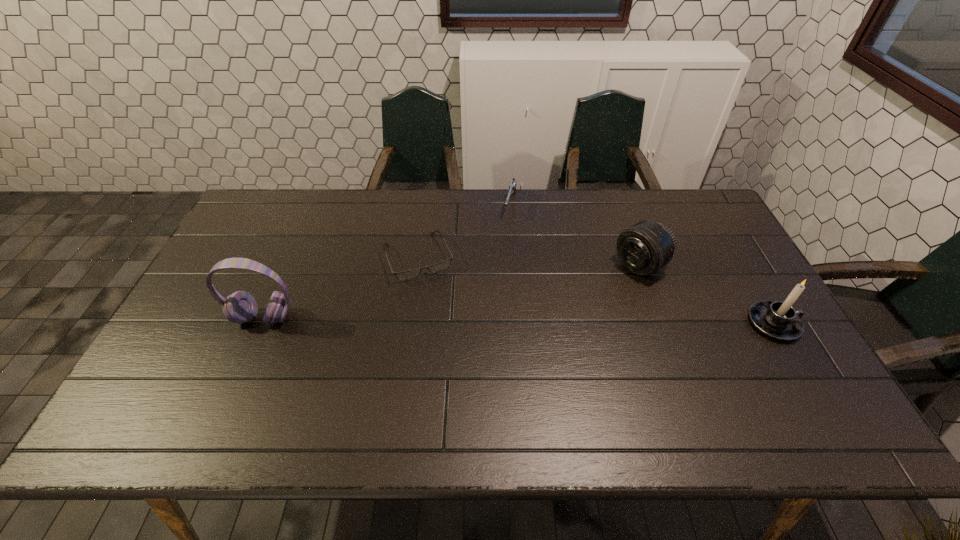
Image resolution: width=960 pixels, height=540 pixels. In order to click on vacant space situated 0.120m on the front-facing side of the fourth object from right to left in this screenshot , I will do `click(442, 312)`.

The height and width of the screenshot is (540, 960). I want to click on free space located on the front-facing side of the fourth object from right to left, so click(453, 340).

Locate an element on the screen. Image resolution: width=960 pixels, height=540 pixels. free region located 0.140m on the front-facing side of the fourth object from right to left is located at coordinates (444, 317).

Find the location of a particular element. The image size is (960, 540). vacant region located 0.280m on the front-facing side of the telephoto lens is located at coordinates (552, 321).

The height and width of the screenshot is (540, 960). In order to click on vacant space located 0.070m on the front-facing side of the telephoto lens in this screenshot , I will do `click(606, 287)`.

I want to click on blank space located on the front-facing side of the telephoto lens, so click(591, 296).

Where is `free location located on the front-facing side of the pistol`? free location located on the front-facing side of the pistol is located at coordinates (506, 232).

What are the coordinates of `free space located on the front-facing side of the pistol` in the screenshot? It's located at (492, 279).

Image resolution: width=960 pixels, height=540 pixels. What are the coordinates of `vacant area situated 0.360m on the front-facing side of the pistol` in the screenshot? It's located at (486, 299).

This screenshot has height=540, width=960. Identify the location of object positioned at the far edge. (512, 187).